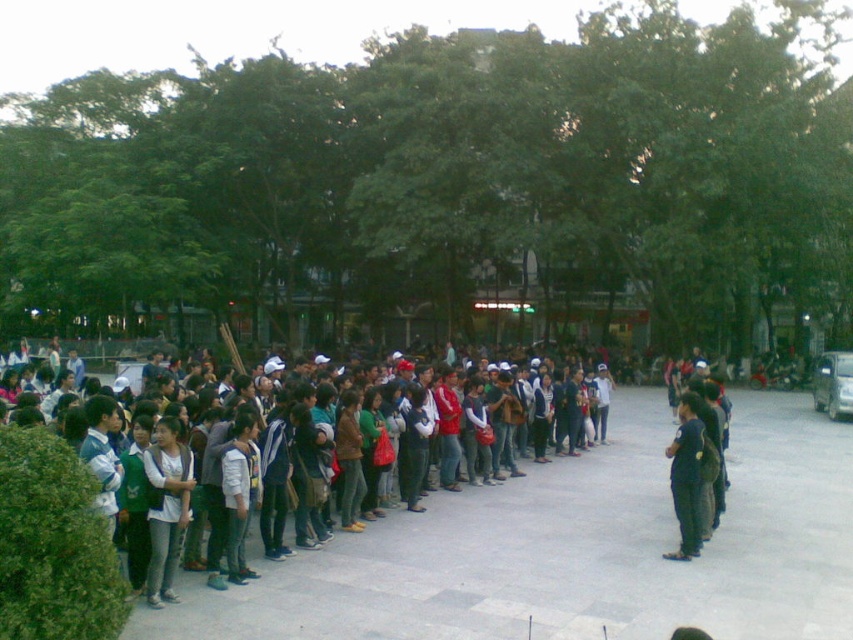
Question: Can you confirm if green leafy tree at center is positioned below dark gray backpack at left?

Choices:
 (A) no
 (B) yes

Answer: (A)

Question: Can you confirm if green leafy tree at center is wider than dark blue jeans at center?

Choices:
 (A) yes
 (B) no

Answer: (A)

Question: Which point is farther to the camera?

Choices:
 (A) (184, 449)
 (B) (653, 595)
 (C) (676, 433)

Answer: (C)

Question: Does green leafy tree at center have a larger size compared to dark gray backpack at left?

Choices:
 (A) no
 (B) yes

Answer: (B)

Question: Which object is the closest to the green leafy tree at center?

Choices:
 (A) dark gray backpack at left
 (B) dark blue jeans at center

Answer: (A)

Question: Which object is the farthest from the light gray jeans at lower left?

Choices:
 (A) dark gray backpack at left
 (B) green leafy tree at center

Answer: (B)